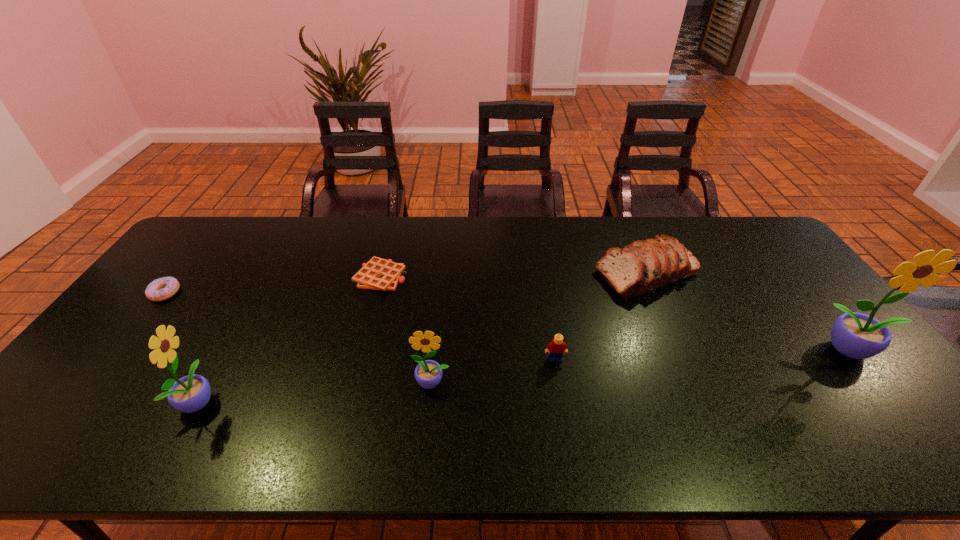
You are a GUI agent. You are given a task and a screenshot of the screen. Output one action in this format:
    pyautogui.click(x=<x>, y=<y>)
    Task: Click on the Lego
    The width and height of the screenshot is (960, 540).
    Given the screenshot: What is the action you would take?
    pyautogui.click(x=556, y=348)

This screenshot has height=540, width=960. In order to click on the third object from right to left in this screenshot , I will do pos(556,348).

This screenshot has width=960, height=540. Identify the location of vacant point located 0.050m on the front-facing side of the second object from left to right. (237, 401).

Locate an element on the screen. free space located on the front-facing side of the fourth object from left to right is located at coordinates (429, 416).

This screenshot has height=540, width=960. I want to click on vacant space located 0.080m on the front-facing side of the rightmost object, so click(888, 395).

Where is `vacant space located 0.080m on the back of the sixth object from left to right`? vacant space located 0.080m on the back of the sixth object from left to right is located at coordinates (629, 233).

Image resolution: width=960 pixels, height=540 pixels. Identify the location of vacant space situated 0.160m on the back of the doughnut. (198, 252).

Find the location of a particular element. vacant region located 0.310m on the front of the waffle is located at coordinates (354, 379).

Locate an element on the screen. The width and height of the screenshot is (960, 540). vacant region located 0.050m on the front-facing side of the Lego is located at coordinates (559, 379).

You are a GUI agent. You are given a task and a screenshot of the screen. Output one action in this format:
    pyautogui.click(x=<x>, y=<y>)
    Task: Click on the object situated at the far edge
    
    Given the screenshot: What is the action you would take?
    pyautogui.click(x=642, y=266)